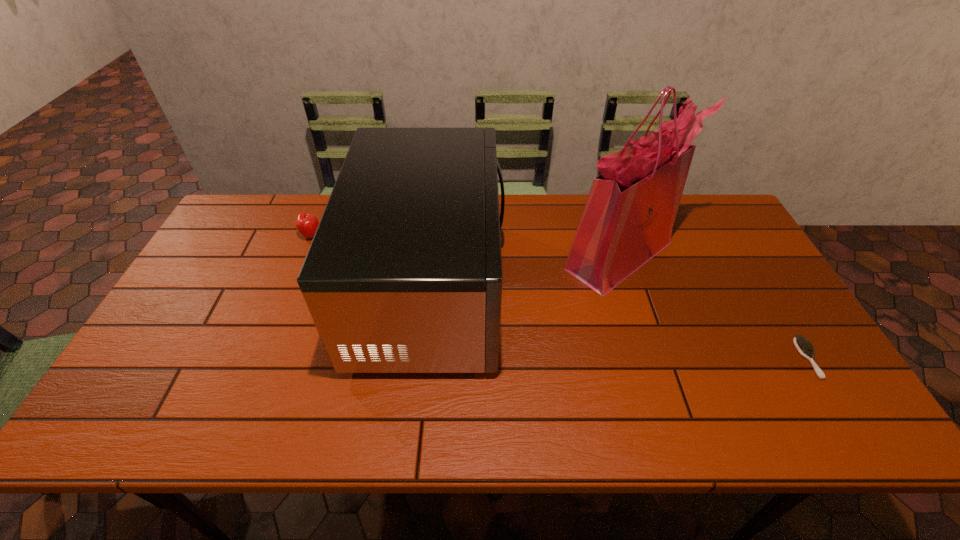
Locate an element on the screen. This screenshot has height=540, width=960. vacant region that satisfies the following two spatial constraints: 1. on the front-facing side of the third object from right to left; 2. on the right side of the scrubbing brush is located at coordinates (422, 359).

Locate an element on the screen. free location that satisfies the following two spatial constraints: 1. on the front-facing side of the second tallest object; 2. on the left side of the shortest object is located at coordinates (422, 359).

The width and height of the screenshot is (960, 540). I want to click on vacant space that satisfies the following two spatial constraints: 1. on the front-facing side of the microwave oven; 2. on the left side of the rightmost object, so click(422, 359).

Identify the location of free location that satisfies the following two spatial constraints: 1. on the front-facing side of the shortest object; 2. on the right side of the microwave oven. tap(422, 359).

The image size is (960, 540). What are the coordinates of `free space in the image that satisfies the following two spatial constraints: 1. on the front-facing side of the microwave oven; 2. on the left side of the rightmost object` in the screenshot? It's located at point(422,359).

This screenshot has height=540, width=960. I want to click on vacant space that satisfies the following two spatial constraints: 1. on the front-facing side of the second tallest object; 2. on the right side of the shortest object, so click(422, 359).

Identify the location of vacant space that satisfies the following two spatial constraints: 1. on the front-facing side of the second tallest object; 2. on the back side of the scrubbing brush. (422, 359).

At what (x,y) coordinates should I click in order to perform the action: click on vacant area that satisfies the following two spatial constraints: 1. on the front side of the rightmost object; 2. on the right side of the apple. Please return your answer as a coordinate pair (x, y). This screenshot has width=960, height=540. Looking at the image, I should click on (261, 359).